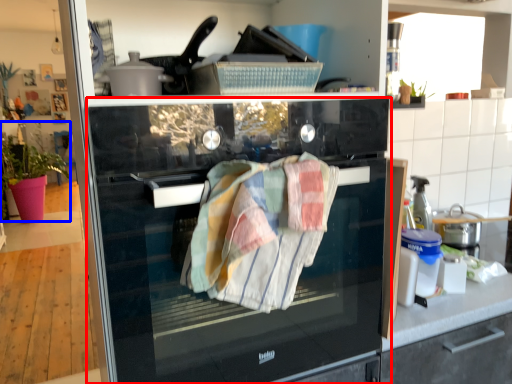
Question: Which object appears farthest to the camera in this image, home appliance (highlighted by a red box) or plant (highlighted by a blue box)?

Choices:
 (A) home appliance
 (B) plant

Answer: (B)